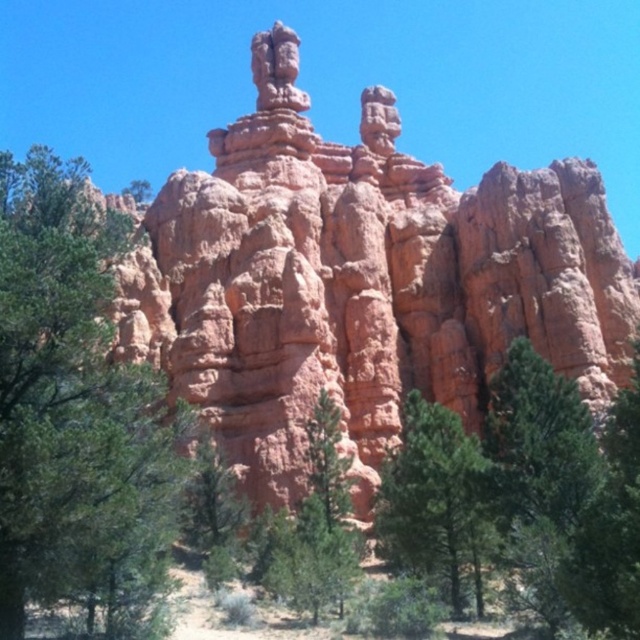
Does green matte tree at left appear under green matte tree at center?

Actually, green matte tree at left is above green matte tree at center.

Does green matte tree at left have a lesser height compared to green matte tree at center?

In fact, green matte tree at left may be taller than green matte tree at center.

Is point (86, 438) in front of point (403, 448)?

Yes, point (86, 438) is closer to viewer.

This screenshot has width=640, height=640. Find the location of `green matte tree at left`. green matte tree at left is located at coordinates (74, 404).